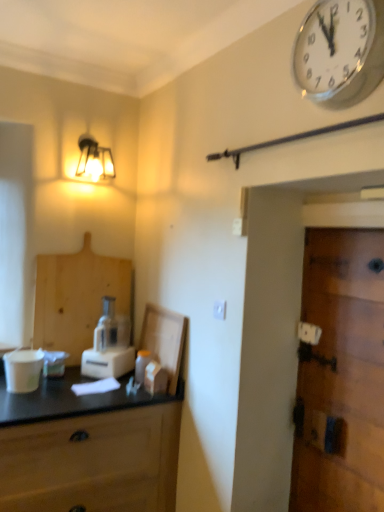
Identify the location of empty space that is ontop of wooden cutting board at left (from a real-world perspective). (90, 226).